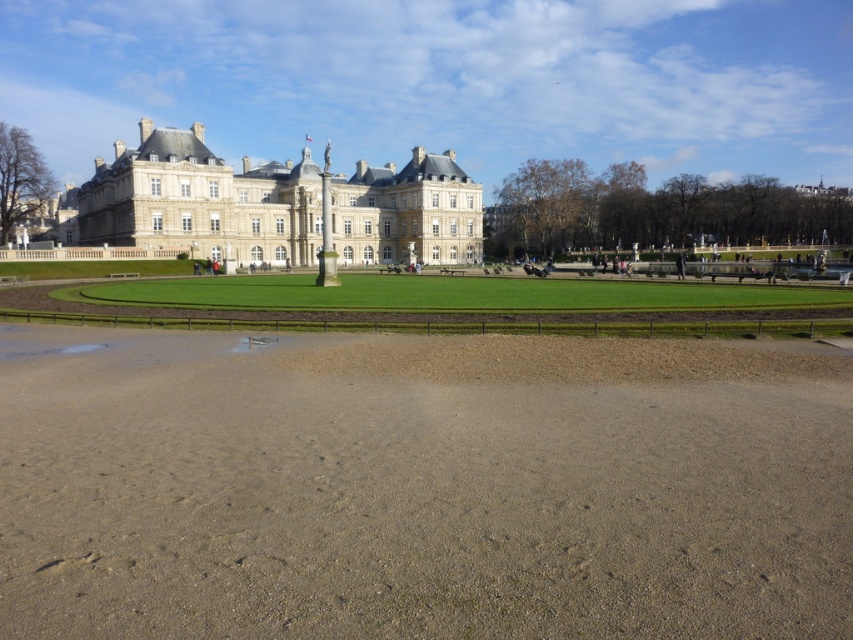
Image resolution: width=853 pixels, height=640 pixels. What are the coordinates of `green grass at center` in the screenshot? It's located at (421, 484).

Can you confirm if green grass at center is positioned to the right of white stone building at center?

Correct, you'll find green grass at center to the right of white stone building at center.

Where is `green grass at center`? green grass at center is located at coordinates (421, 484).